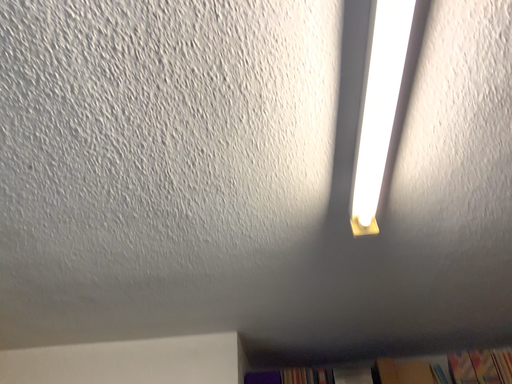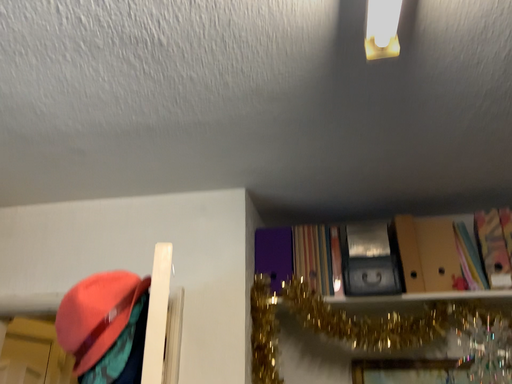
Question: How did the camera likely rotate when shooting the video?

Choices:
 (A) rotated downward
 (B) rotated upward

Answer: (A)